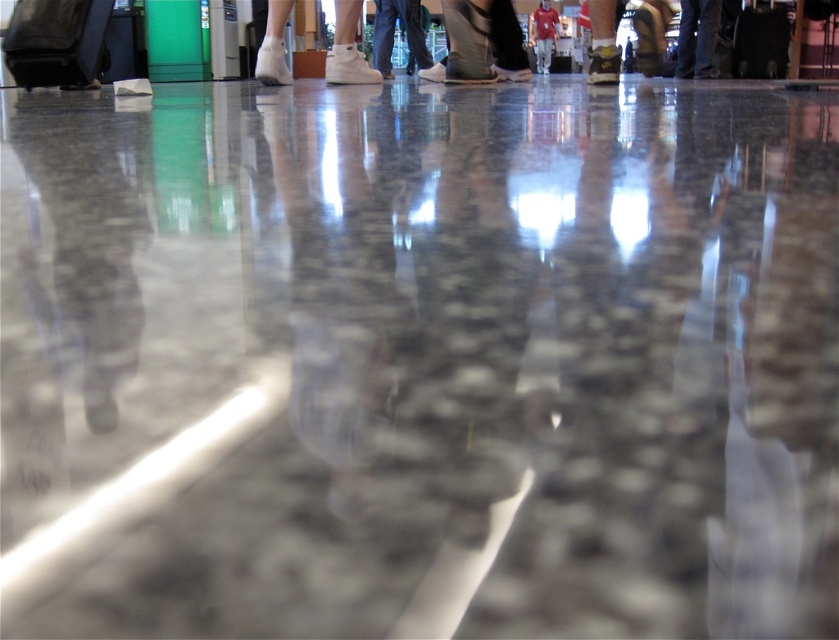
You are standing in the transportation hub and see the dark blue jeans at center and the matte black suitcase at center. Based on their positions, which one is closer to the floor?

The dark blue jeans at center is below matte black suitcase at center, so the dark blue jeans at center is closer to the floor.

You are a traveler who needs to choose between the black matte suitcase at upper left and the matte black suitcase at center for your trip. Based on the scene description, which suitcase has a greater width?

The black matte suitcase at upper left has a greater width than the matte black suitcase at center according to the description.